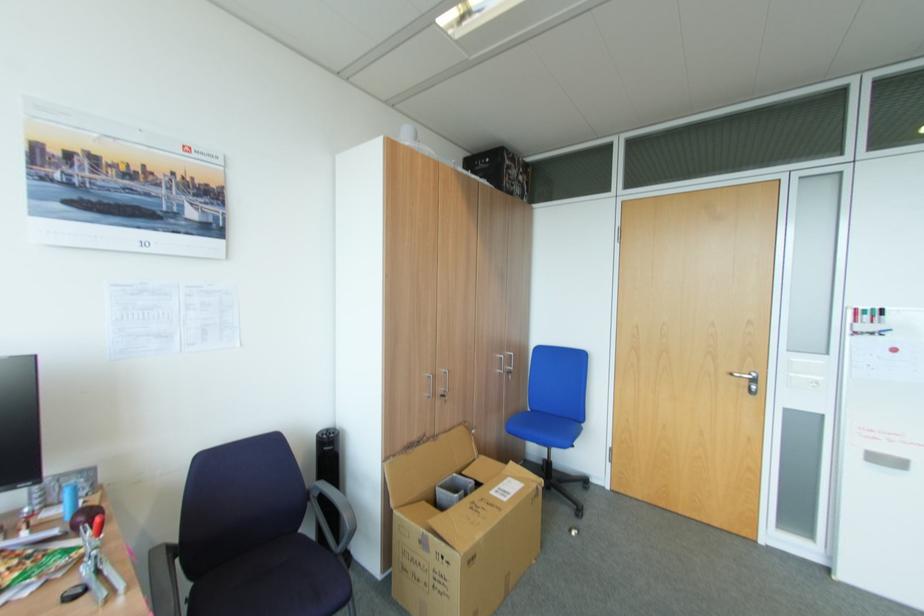
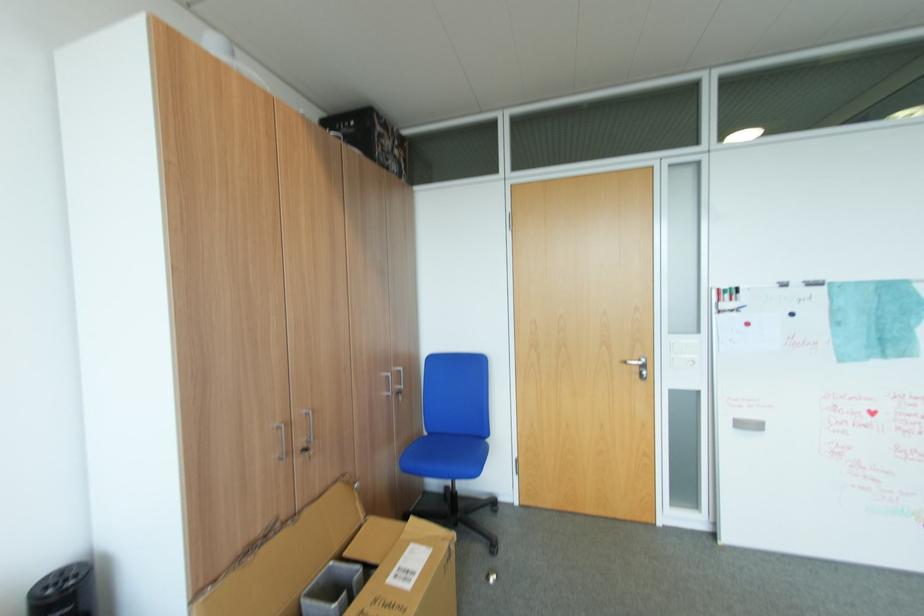
In the second image, find the point that corresponds to point (447, 485) in the first image.

(317, 593)